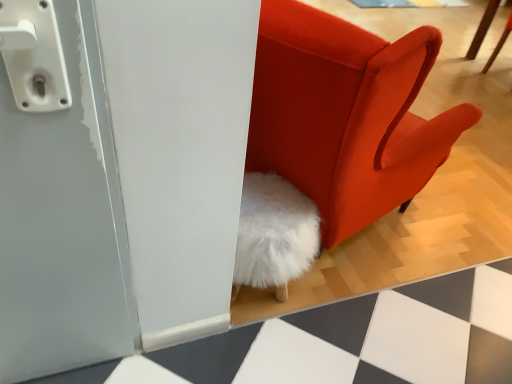
Image resolution: width=512 pixels, height=384 pixels. Find the location of `free space in front of velvet orange chair at center`. free space in front of velvet orange chair at center is located at coordinates (340, 337).